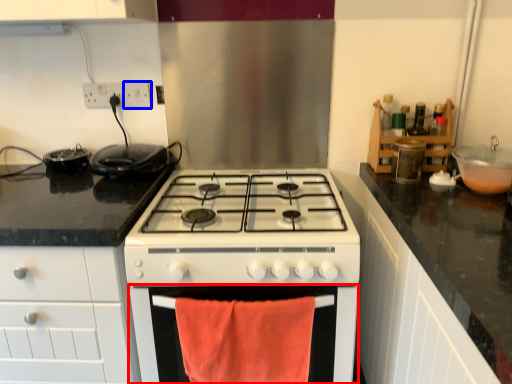
Question: Among these objects, which one is farthest to the camera, oven (highlighted by a red box) or electric outlet (highlighted by a blue box)?

Choices:
 (A) oven
 (B) electric outlet

Answer: (B)